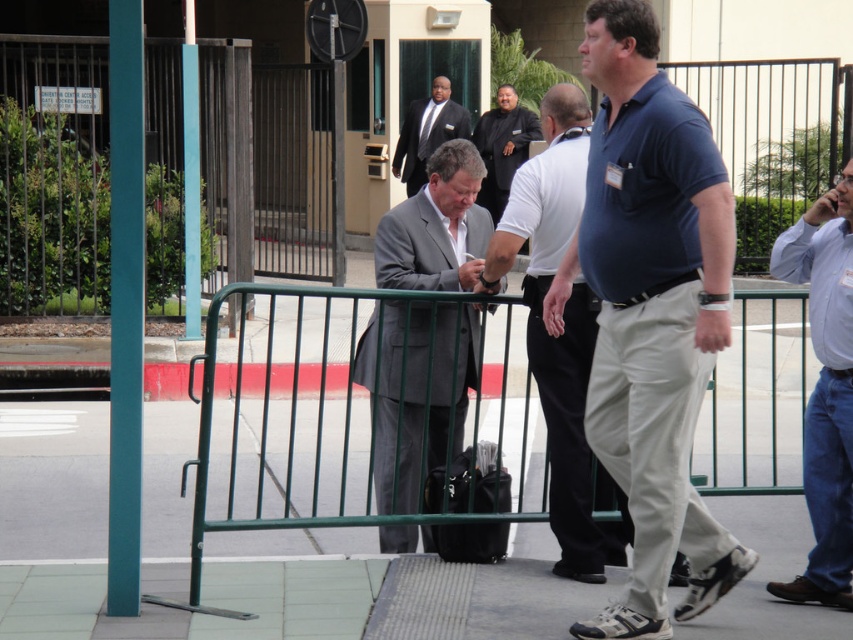
You are at an event and need to identify which person is closer to the building entrance based on their clothing. The blue cotton polo shirt at center and the dark blue suit at center are both visible. Which one is taller?

The blue cotton polo shirt at center is taller than the dark blue suit at center, so the person wearing the blue cotton polo shirt at center is taller.

You are a photographer trying to capture a clear shot of the dark blue suit at center. However, the green metal fence at center is blocking your view. Can you estimate whether the fence is tall enough to completely obscure the suit from your current position?

The green metal fence at center is taller than the dark blue suit at center, so the fence will completely block the view of the dark blue suit at center from your current position.

You are attending an event and need to locate two people wearing a blue cotton polo shirt at center and a dark blue suit at center. According to the scene, which one is positioned lower in the image?

The blue cotton polo shirt at center is located below the dark blue suit at center, so it is positioned lower in the image.